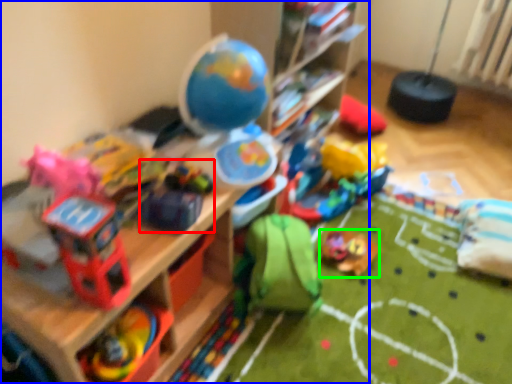
Question: Which object is the farthest from toy (highlighted by a red box)? Choose among these: shelf (highlighted by a blue box) or toy (highlighted by a green box).

Choices:
 (A) shelf
 (B) toy

Answer: (B)